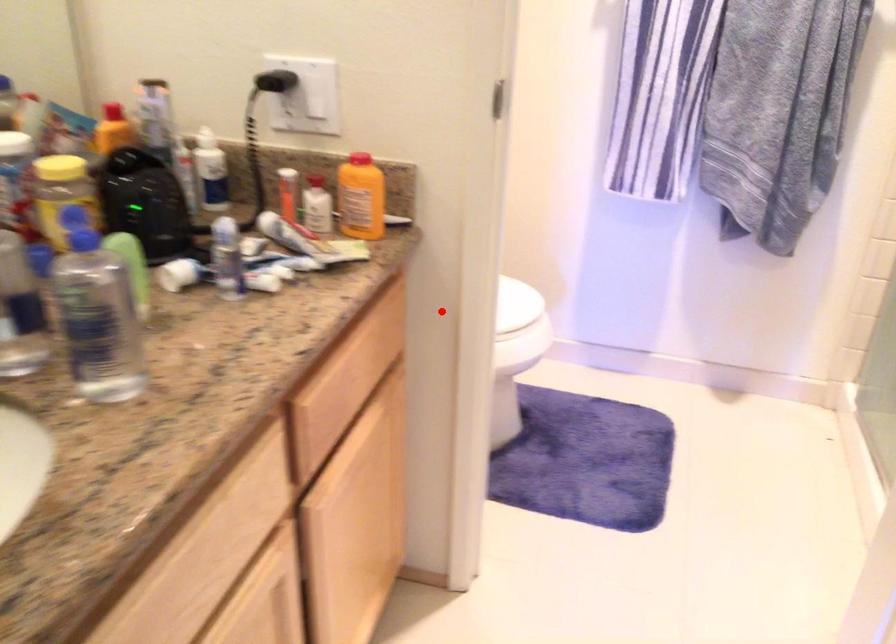
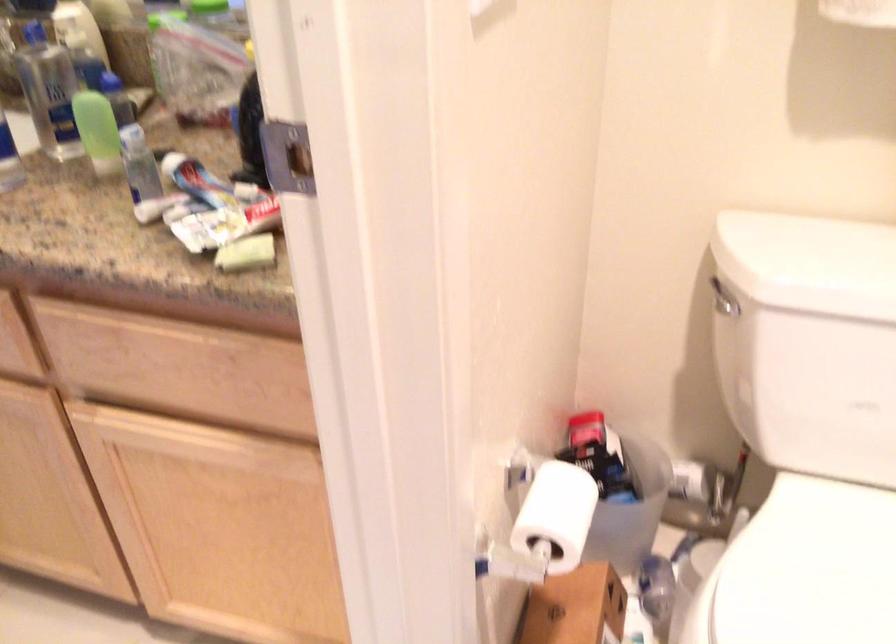
Question: A red point is marked in image1. In image2, is the corresponding 3D point closer to the camera or farther? Reply with the corresponding letter.

Choices:
 (A) The corresponding 3D point is closer.
 (B) The corresponding 3D point is farther.

Answer: (A)